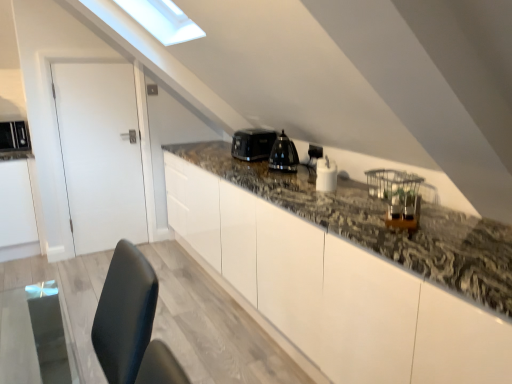
Question: Can you confirm if white matte door at left is positioned to the right of granite countertop at center?

Choices:
 (A) no
 (B) yes

Answer: (A)

Question: Is white matte door at left aimed at granite countertop at center?

Choices:
 (A) no
 (B) yes

Answer: (A)

Question: Is the position of white matte door at left less distant than that of granite countertop at center?

Choices:
 (A) no
 (B) yes

Answer: (A)

Question: Can you confirm if white matte door at left is shorter than granite countertop at center?

Choices:
 (A) no
 (B) yes

Answer: (A)

Question: Is white matte door at left to the left of granite countertop at center from the viewer's perspective?

Choices:
 (A) no
 (B) yes

Answer: (B)

Question: Does white matte door at left lie behind granite countertop at center?

Choices:
 (A) yes
 (B) no

Answer: (A)

Question: Is granite countertop at center to the right of black glossy kettle at center, which ranks as the 4th appliance in back-to-front order, from the viewer's perspective?

Choices:
 (A) no
 (B) yes

Answer: (B)

Question: From the image's perspective, is granite countertop at center beneath black glossy kettle at center, which ranks as the 4th appliance in back-to-front order?

Choices:
 (A) no
 (B) yes

Answer: (B)

Question: Could you tell me if granite countertop at center is turned towards black glossy kettle at center, positioned as the 3th appliance in left-to-right order?

Choices:
 (A) no
 (B) yes

Answer: (A)

Question: Is granite countertop at center facing away from black glossy kettle at center, positioned as the 3th appliance in left-to-right order?

Choices:
 (A) yes
 (B) no

Answer: (B)

Question: Considering the relative sizes of granite countertop at center and black glossy kettle at center, the second appliance when ordered from front to back, in the image provided, is granite countertop at center bigger than black glossy kettle at center, the second appliance when ordered from front to back,?

Choices:
 (A) yes
 (B) no

Answer: (A)

Question: From a real-world perspective, is granite countertop at center over black glossy kettle at center, which ranks as the 3th appliance in right-to-left order?

Choices:
 (A) no
 (B) yes

Answer: (A)

Question: From a real-world perspective, is white glossy salt shaker at center, the first appliance viewed from the front, physically below black glossy kettle at upper center, the third appliance positioned from the front?

Choices:
 (A) no
 (B) yes

Answer: (B)